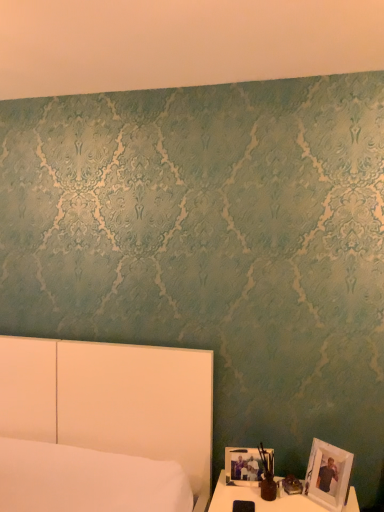
Where is `vacant space to the left of matte brown vase at lower right`? vacant space to the left of matte brown vase at lower right is located at coordinates [236, 497].